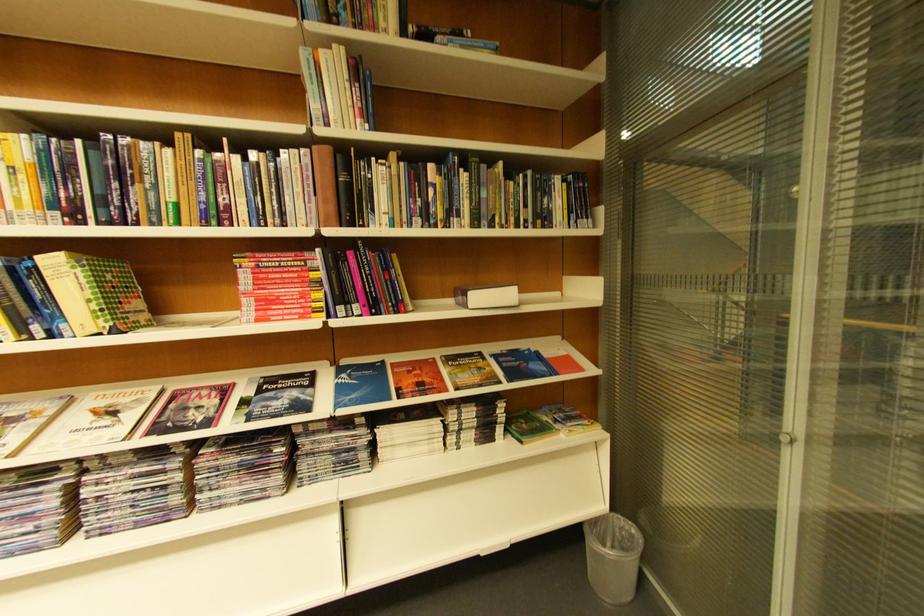
Find where to lift the Nature magazine. Please return your answer as a coordinate pair (x, y).

(188, 410)